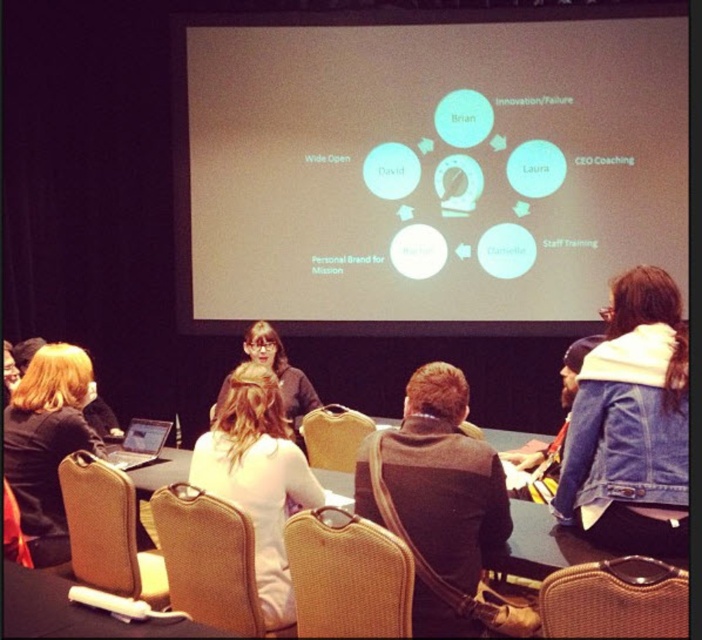
You are a presenter standing at the table facing the audience. You need to retrieve your denim jacket which is at point (630, 426). Can you reach it without moving from your current position?

The denim jacket at lower right is located at point (630, 426). Since you are standing at the table facing the audience, you might not be able to reach it without moving, as the jacket is positioned to your lower right, possibly out of arm reach.

You are attending a presentation in a conference room and notice a braided wood chair at lower center and a silver metallic laptop at lower left. Which object takes up more space in the scene?

The braided wood chair at lower center is larger in size than the silver metallic laptop at lower left, so it takes up more space in the scene.

You are organizing a presentation and need to place a name tag on the table between the denim jacket at lower right and the silver metallic laptop at lower left. Based on their sizes, which object should the name tag be placed closer to to ensure it fits comfortably?

The denim jacket at lower right has a larger width than the silver metallic laptop at lower left, so placing the name tag closer to the silver metallic laptop at lower left would leave more space for the denim jacket at lower right.